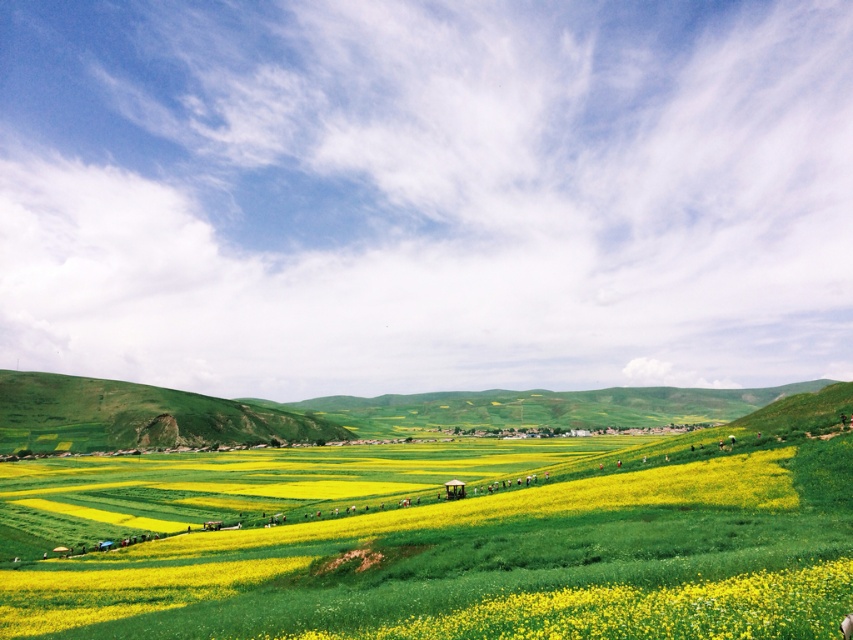
Which is more to the left, yellow matte flower at center or green grassy hillside at left?

green grassy hillside at left is more to the left.

Who is more distant from viewer, (808, 621) or (94, 426)?

Positioned behind is point (94, 426).

Image resolution: width=853 pixels, height=640 pixels. Identify the location of yellow matte flower at center. (643, 611).